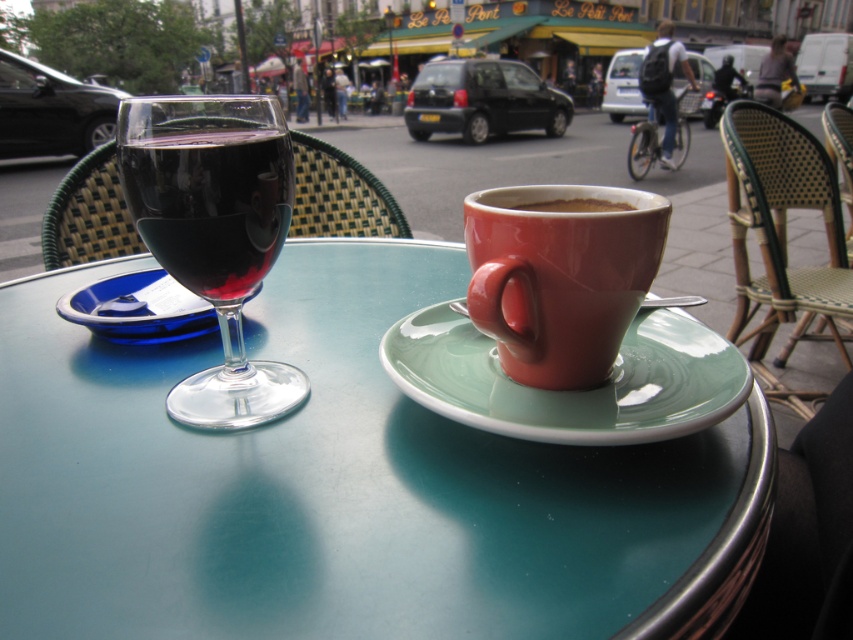
Question: Which point is closer to the camera?

Choices:
 (A) matte glass wine at left
 (B) mint ceramic saucer at center
 (C) matte ceramic mug at center

Answer: (B)

Question: Is matte glass wine at left further to the viewer compared to matte ceramic cup at center?

Choices:
 (A) no
 (B) yes

Answer: (A)

Question: Which point is closer to the camera taking this photo?

Choices:
 (A) (639, 276)
 (B) (171, 227)

Answer: (B)

Question: Based on their relative distances, which object is nearer to the transparent glass wine glass at left?

Choices:
 (A) matte glass wine at left
 (B) blue glass saucer at left
 (C) matte ceramic mug at center

Answer: (A)

Question: Does smooth glass table at center appear on the right side of transparent glass wine glass at left?

Choices:
 (A) no
 (B) yes

Answer: (B)

Question: Is mint ceramic saucer at center positioned at the back of matte glass wine at left?

Choices:
 (A) yes
 (B) no

Answer: (B)